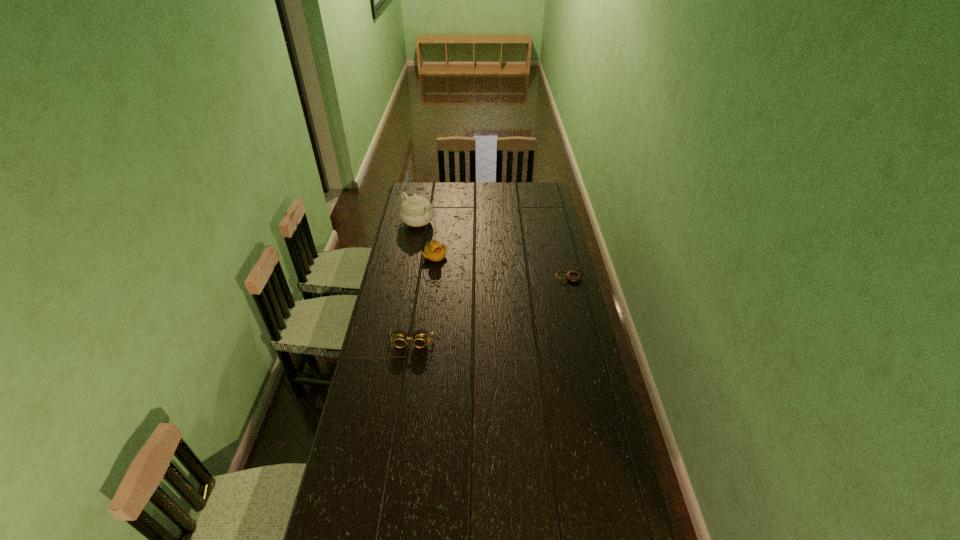
Find the location of a particular element. Image resolution: width=960 pixels, height=540 pixels. the second shortest object is located at coordinates (419, 338).

The height and width of the screenshot is (540, 960). What are the coordinates of `goggles` in the screenshot? It's located at (419, 338).

Identify the location of the rightmost object. (572, 276).

At what (x,y) coordinates should I click in order to perform the action: click on pocket watch. Please return your answer as a coordinate pair (x, y). Looking at the image, I should click on (572, 276).

Identify the location of the second tallest object. Image resolution: width=960 pixels, height=540 pixels. (433, 251).

Locate an element on the screen. the farthest object is located at coordinates (415, 211).

Identify the location of the tallest object. This screenshot has height=540, width=960. (415, 211).

This screenshot has width=960, height=540. Identify the location of vacant area situated through the lenses of the nearest object. (406, 379).

Identify the location of vacant position located 0.270m on the back of the shortest object. The width and height of the screenshot is (960, 540). (560, 232).

The height and width of the screenshot is (540, 960). In order to click on vacant point located 0.330m on the front-facing side of the duckling in this screenshot , I will do `click(487, 294)`.